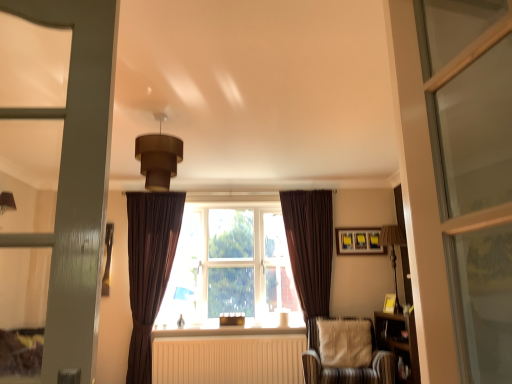
Question: Is white matte radiator at center smaller than wooden bookshelf at right?

Choices:
 (A) no
 (B) yes

Answer: (B)

Question: Is white matte radiator at center bigger than wooden bookshelf at right?

Choices:
 (A) no
 (B) yes

Answer: (A)

Question: Considering the relative sizes of white matte radiator at center and wooden bookshelf at right in the image provided, is white matte radiator at center shorter than wooden bookshelf at right?

Choices:
 (A) no
 (B) yes

Answer: (B)

Question: Is white matte radiator at center at the right side of wooden bookshelf at right?

Choices:
 (A) yes
 (B) no

Answer: (B)

Question: Is wooden bookshelf at right surrounded by white matte radiator at center?

Choices:
 (A) yes
 (B) no

Answer: (B)

Question: Is white matte radiator at center thinner than wooden bookshelf at right?

Choices:
 (A) yes
 (B) no

Answer: (A)

Question: Can you confirm if brown velvet curtain at left, the 2th curtain viewed from the right, is smaller than brown matte/soft pendant light at upper center, the second light fixture in the bottom-to-top sequence?

Choices:
 (A) yes
 (B) no

Answer: (B)

Question: From a real-world perspective, is brown velvet curtain at left, the 2th curtain viewed from the right, below brown matte/soft pendant light at upper center, acting as the 2th light fixture starting from the back?

Choices:
 (A) yes
 (B) no

Answer: (A)

Question: Does brown velvet curtain at left, the 2th curtain viewed from the right, come behind brown matte/soft pendant light at upper center, positioned as the first light fixture in left-to-right order?

Choices:
 (A) no
 (B) yes

Answer: (B)

Question: Can you confirm if brown velvet curtain at left, the 2th curtain viewed from the right, is thinner than brown matte/soft pendant light at upper center, the second light fixture in the bottom-to-top sequence?

Choices:
 (A) yes
 (B) no

Answer: (A)

Question: From a real-world perspective, is brown velvet curtain at left, the 2th curtain viewed from the right, physically above brown matte/soft pendant light at upper center, the first light fixture positioned from the front?

Choices:
 (A) yes
 (B) no

Answer: (B)

Question: Does brown velvet curtain at left, the 2th curtain viewed from the right, turn towards brown matte/soft pendant light at upper center, which ranks as the second light fixture in right-to-left order?

Choices:
 (A) no
 (B) yes

Answer: (B)

Question: Considering the relative sizes of brown velvet curtain at right, which is the 1th curtain in right-to-left order, and brown fabric window at center in the image provided, is brown velvet curtain at right, which is the 1th curtain in right-to-left order, shorter than brown fabric window at center?

Choices:
 (A) no
 (B) yes

Answer: (A)